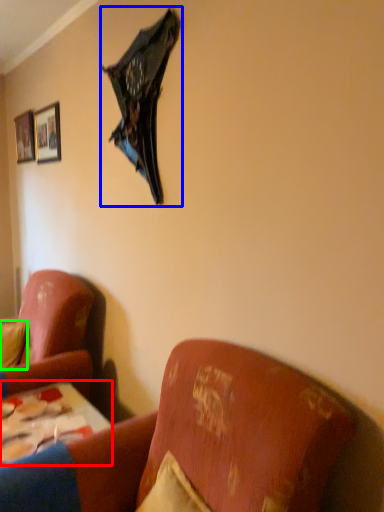
Question: Which object is the closest to the table (highlighted by a red box)? Choose among these: umbrella (highlighted by a blue box) or pillow (highlighted by a green box).

Choices:
 (A) umbrella
 (B) pillow

Answer: (B)